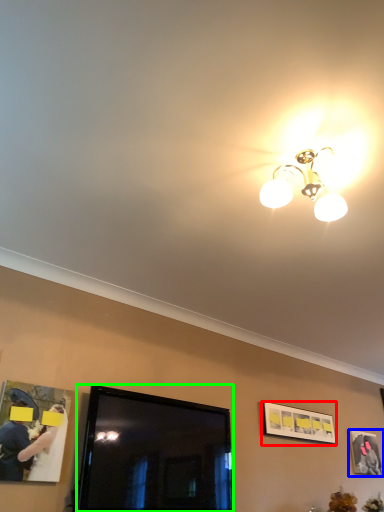
Question: Which object is the farthest from picture frame (highlighted by a red box)? Choose among these: picture frame (highlighted by a blue box) or television (highlighted by a green box).

Choices:
 (A) picture frame
 (B) television

Answer: (B)